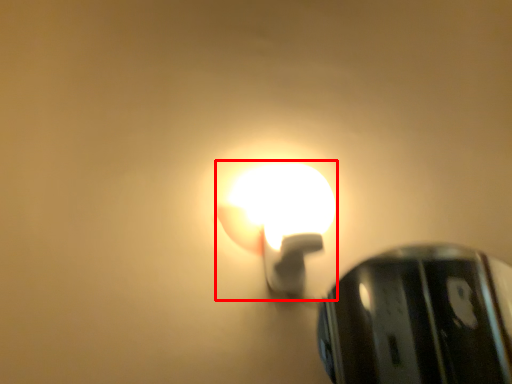
Question: From the image, what is the correct spatial relationship of lamp (annotated by the red box) in relation to lamp?

Choices:
 (A) right
 (B) left

Answer: (B)